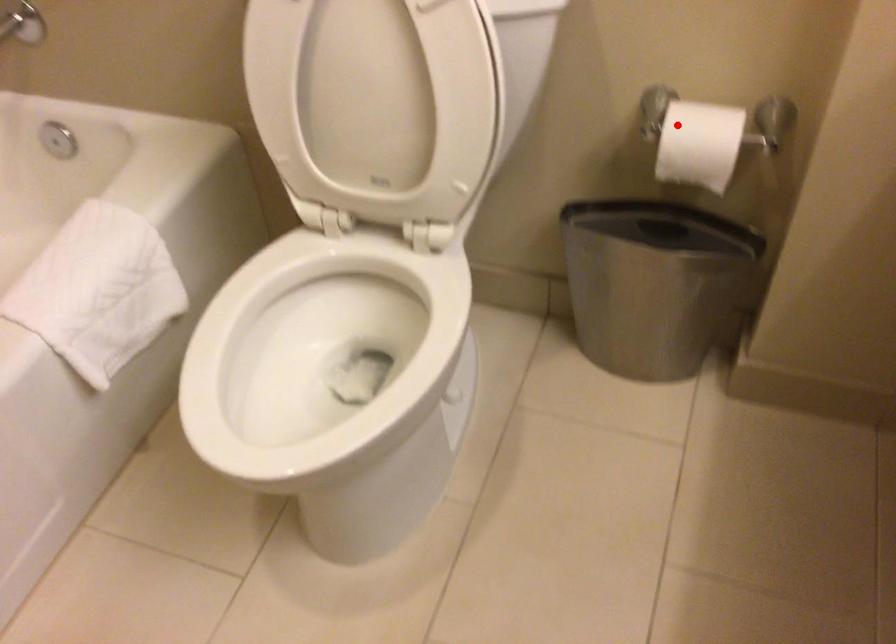
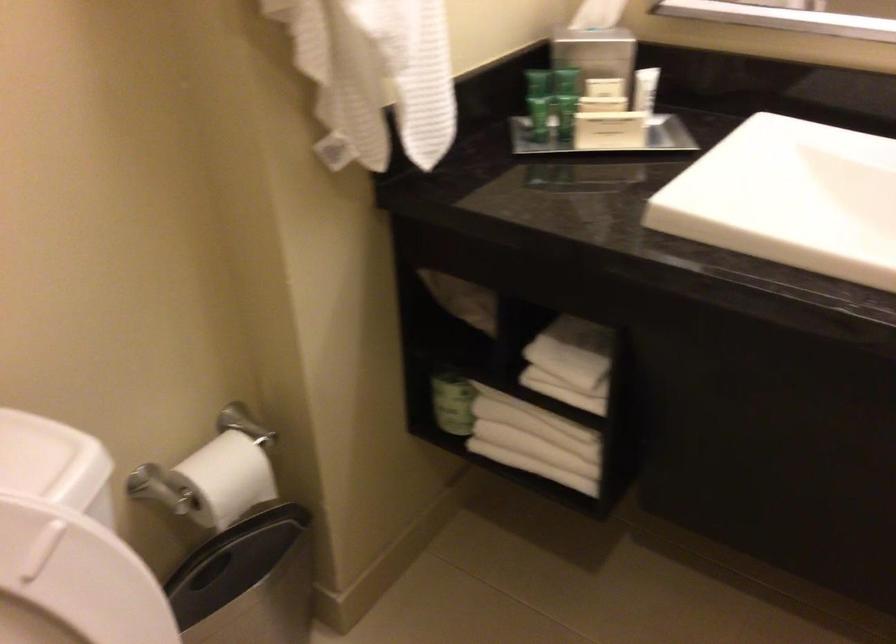
Locate, in the second image, the point that corresponds to the highlighted location in the first image.

(211, 480)